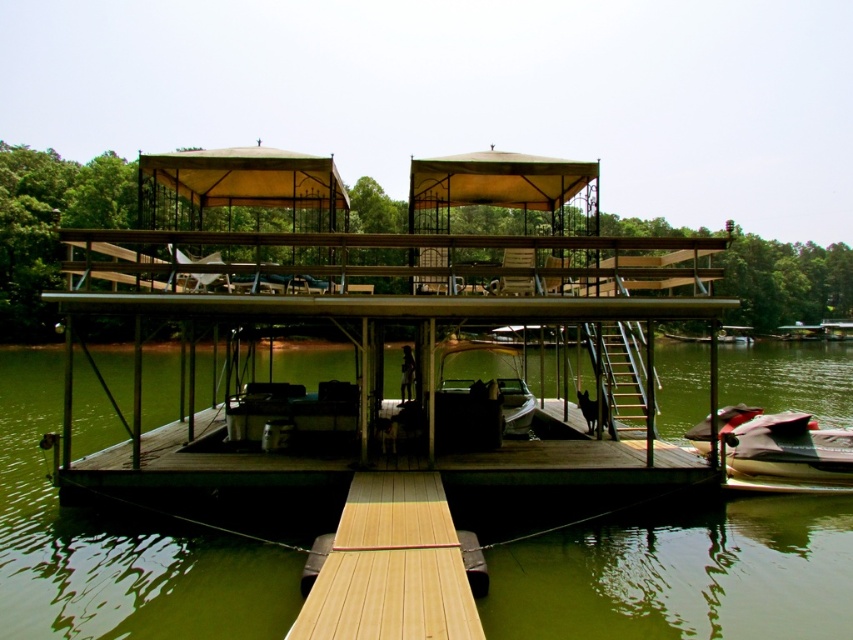
You are standing at the point with coordinates point (405, 628) on the floating dock. If you want to take a photo of the entire dock structure, where should you position yourself relative to the camera to ensure the entire structure fits in the frame?

Since point (405, 628) is 5.14 meters away from the camera, you should position yourself at least 5.14 meters away from the point to capture the entire dock structure in the photo.

Based on the coordinates provided, where is the green water at center located in the image?

The green water at center is located at the coordinates point (682, 576) in the image.

You are standing on the upper deck of the floating dock and looking down. You see the green water at center and the light brown wood at center. Which object is directly above the other?

The light brown wood at center is directly above the green water at center because the green water at center is positioned under it.